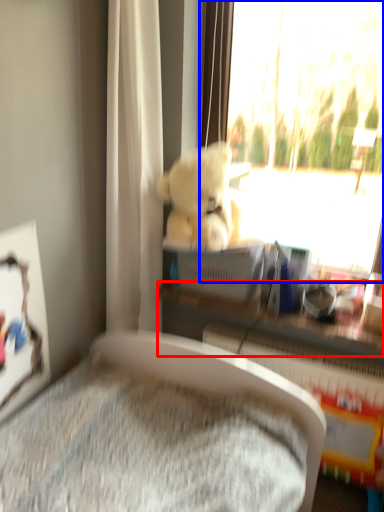
Question: Which point is further to the camera, shelf (highlighted by a red box) or window (highlighted by a blue box)?

Choices:
 (A) shelf
 (B) window

Answer: (A)